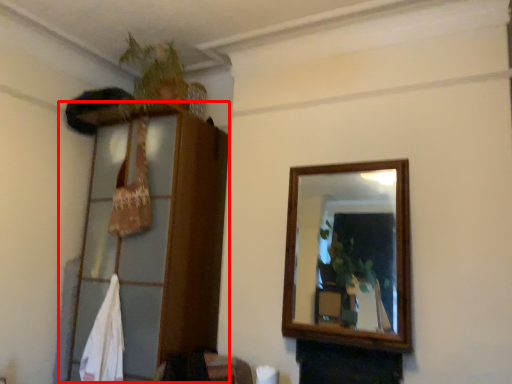
Question: Observing the image, what is the correct spatial positioning of dresser (annotated by the red box) in reference to plant?

Choices:
 (A) left
 (B) right

Answer: (A)